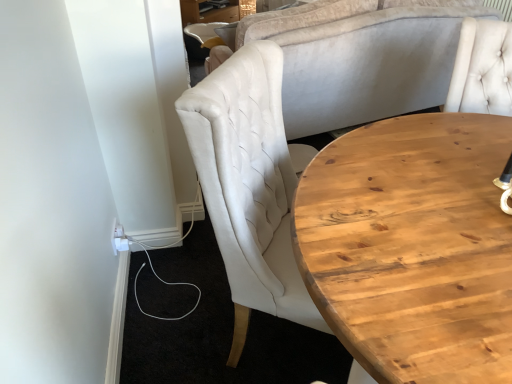
Question: Is matte white chair at upper left thinner than light brown wooden coffee table at right?

Choices:
 (A) yes
 (B) no

Answer: (A)

Question: Could you tell me if matte white chair at upper left is facing light brown wooden coffee table at right?

Choices:
 (A) no
 (B) yes

Answer: (A)

Question: Does matte white chair at upper left come behind light brown wooden coffee table at right?

Choices:
 (A) no
 (B) yes

Answer: (B)

Question: Is matte white chair at upper left completely or partially outside of light brown wooden coffee table at right?

Choices:
 (A) no
 (B) yes

Answer: (B)

Question: Are matte white chair at upper left and light brown wooden coffee table at right far apart?

Choices:
 (A) no
 (B) yes

Answer: (B)

Question: Is matte white chair at upper left surrounding light brown wooden coffee table at right?

Choices:
 (A) no
 (B) yes

Answer: (A)

Question: From the image's perspective, is light brown wooden coffee table at right on matte white chair at upper left?

Choices:
 (A) no
 (B) yes

Answer: (A)

Question: Is light brown wooden coffee table at right closer to the viewer compared to matte white chair at upper left?

Choices:
 (A) no
 (B) yes

Answer: (B)

Question: Considering the relative sizes of light brown wooden coffee table at right and matte white chair at upper left in the image provided, is light brown wooden coffee table at right shorter than matte white chair at upper left?

Choices:
 (A) no
 (B) yes

Answer: (A)

Question: Considering the relative sizes of light brown wooden coffee table at right and matte white chair at upper left in the image provided, is light brown wooden coffee table at right smaller than matte white chair at upper left?

Choices:
 (A) no
 (B) yes

Answer: (A)

Question: Is light brown wooden coffee table at right completely or partially outside of matte white chair at upper left?

Choices:
 (A) yes
 (B) no

Answer: (A)

Question: Can you confirm if light brown wooden coffee table at right is thinner than matte white chair at upper left?

Choices:
 (A) yes
 (B) no

Answer: (B)

Question: Is matte white chair at upper left in front of or behind light brown wooden coffee table at right in the image?

Choices:
 (A) front
 (B) behind

Answer: (B)